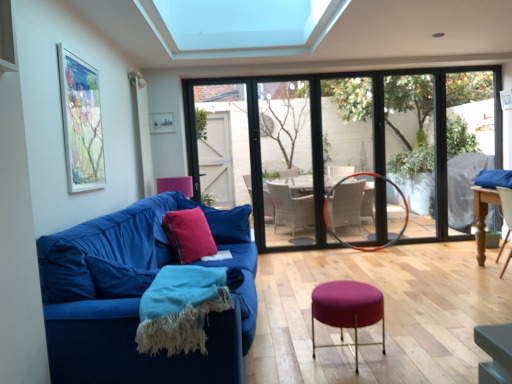
Find the location of a particular element. free space above metallic silver picture frame at upper left, positioned as the second picture frame in back-to-front order (from a real-world perspective) is located at coordinates (77, 55).